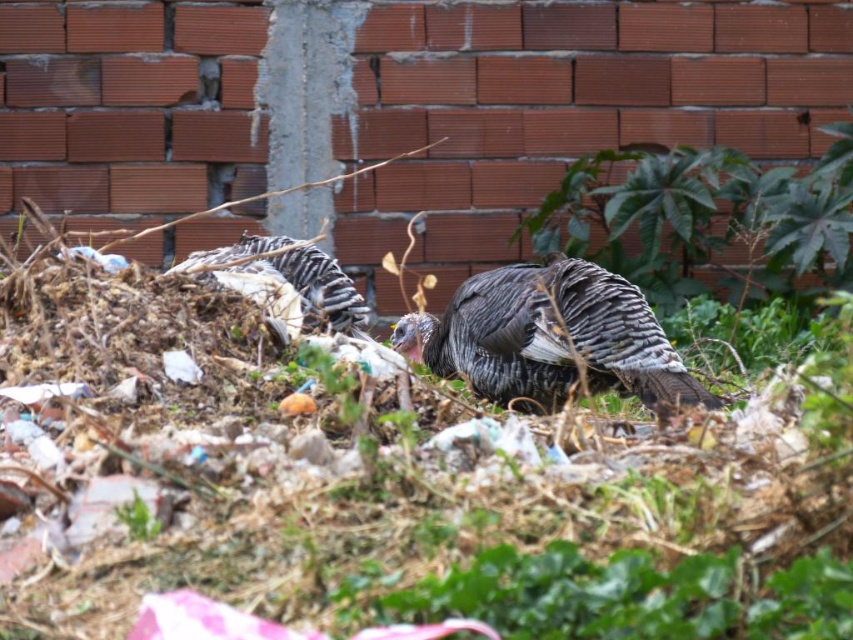
Question: Among these objects, which one is farthest from the camera?

Choices:
 (A) speckled feathered turkey at center
 (B) gray matte turkey at center

Answer: (A)

Question: Is gray matte turkey at center to the left of speckled feathered turkey at center from the viewer's perspective?

Choices:
 (A) yes
 (B) no

Answer: (B)

Question: Is gray matte turkey at center in front of speckled feathered turkey at center?

Choices:
 (A) no
 (B) yes

Answer: (B)

Question: Which of the following is the closest to the observer?

Choices:
 (A) speckled feathered turkey at center
 (B) gray matte turkey at center

Answer: (B)

Question: Does gray matte turkey at center have a larger size compared to speckled feathered turkey at center?

Choices:
 (A) yes
 (B) no

Answer: (A)